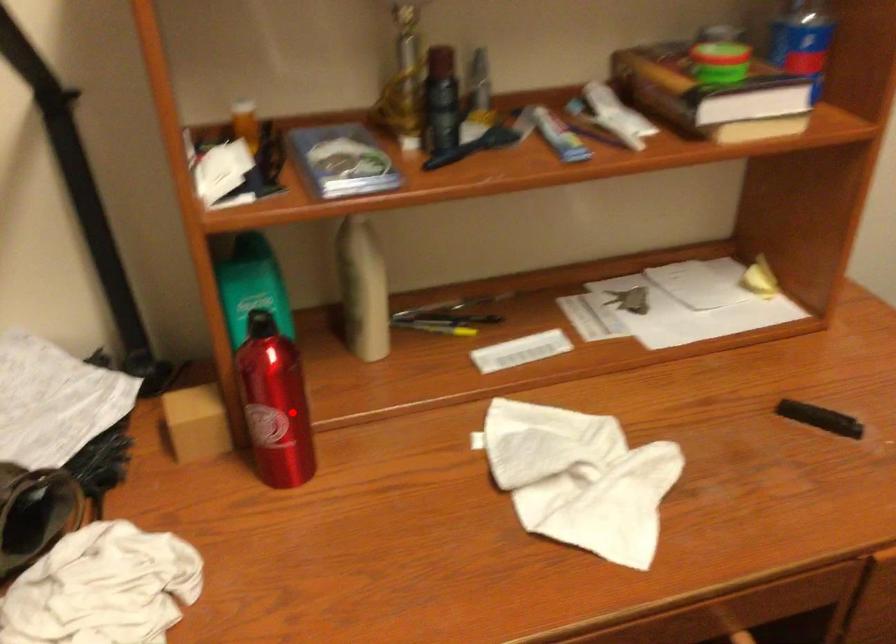
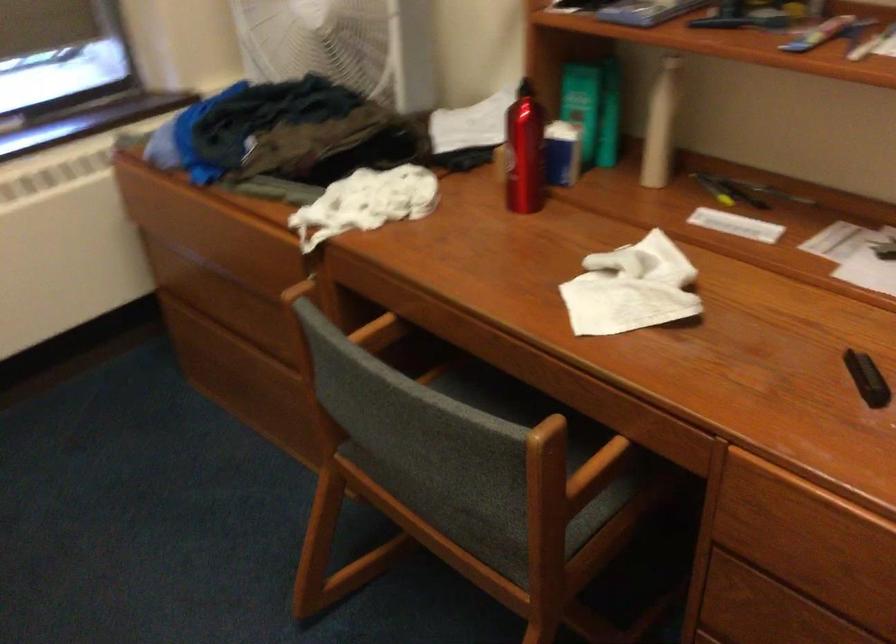
Where in the second image is the point corresponding to the highlighted location from the first image?

(524, 152)